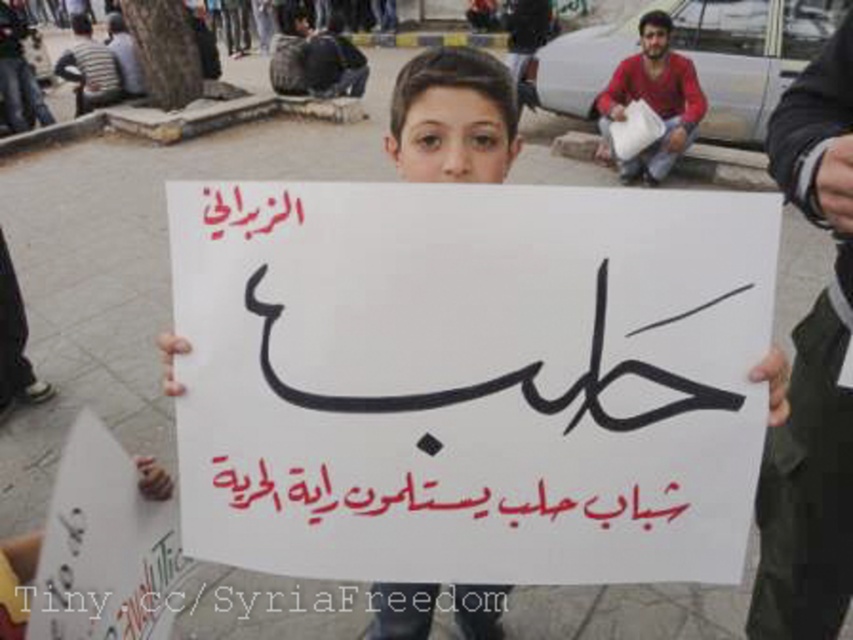
Does red calligraphy at center appear over red cotton shirt at upper right?

Incorrect, red calligraphy at center is not positioned above red cotton shirt at upper right.

The width and height of the screenshot is (853, 640). Describe the element at coordinates (432, 493) in the screenshot. I see `red calligraphy at center` at that location.

Measure the distance between point (300, 472) and camera.

1.08 meters

Where is `red calligraphy at center`? red calligraphy at center is located at coordinates (432, 493).

Is white paper sign at center taller than red calligraphy at center?

Yes.

Does white paper sign at center have a greater width compared to red calligraphy at center?

Yes.

Is point (273, 380) closer to camera compared to point (428, 474)?

That is True.

At what (x,y) coordinates should I click in order to perform the action: click on white paper sign at center. Please return your answer as a coordinate pair (x, y). The image size is (853, 640). Looking at the image, I should click on (469, 380).

Does white paper sign at center have a greater width compared to white paper at center?

Correct, the width of white paper sign at center exceeds that of white paper at center.

Is point (596, 275) positioned after point (459, 166)?

No, (596, 275) is in front of (459, 166).

Identify the location of white paper sign at center. (469, 380).